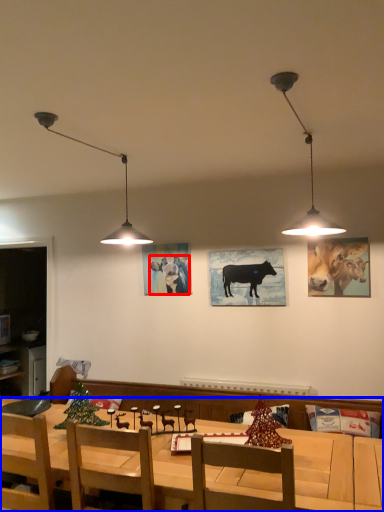
Question: Among these objects, which one is farthest to the camera, cattle (highlighted by a red box) or desk (highlighted by a blue box)?

Choices:
 (A) cattle
 (B) desk

Answer: (A)